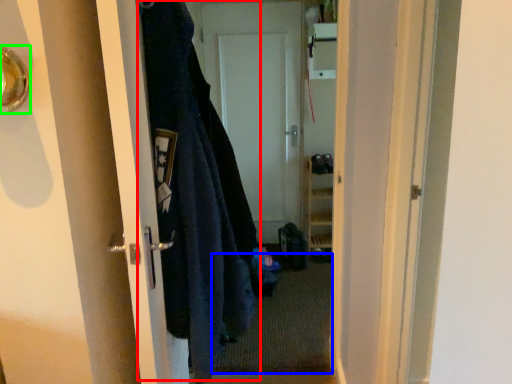
Question: Based on their relative distances, which object is nearer to garment (highlighted by a red box)? Choose from doormat (highlighted by a blue box) and door handle (highlighted by a green box).

Choices:
 (A) doormat
 (B) door handle

Answer: (B)